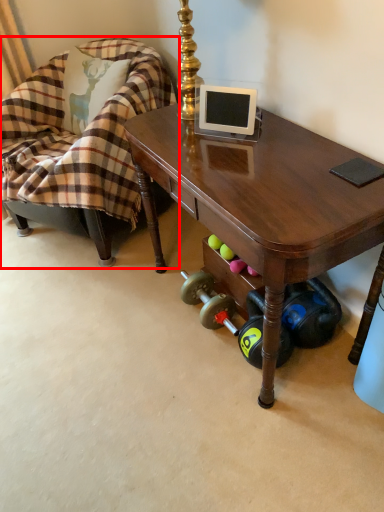
Question: Where is chair (annotated by the red box) located in relation to desk in the image?

Choices:
 (A) left
 (B) right

Answer: (A)